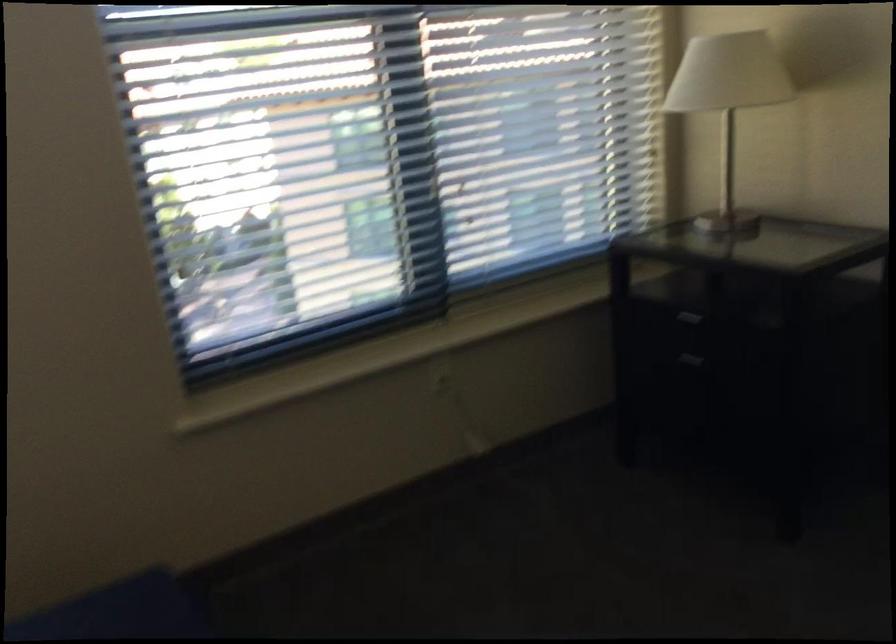
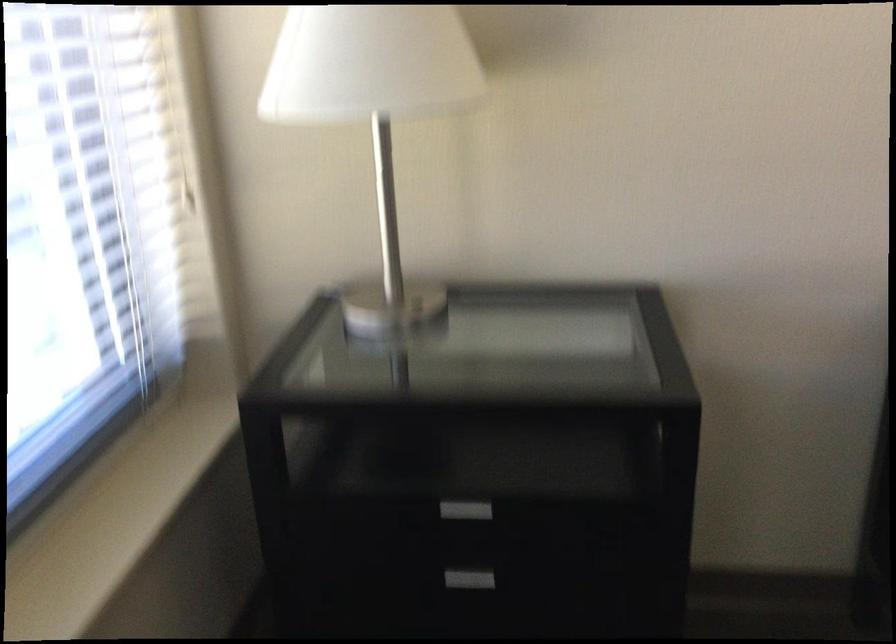
In the second image, find the point that corresponds to point (677, 335) in the first image.

(461, 511)